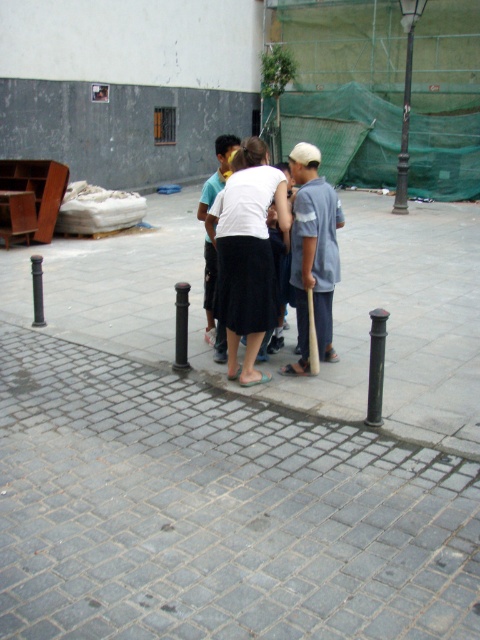
You are standing at the point marked as point (213, 304) in the image. What object is located at that point?

The point (213, 304) corresponds to the white cotton shirt at center.

You are a photographer trying to capture a candid shot of the group. You notice the white matte skirt at center and the wooden baseball bat at center. Which object should you focus on to ensure the subject is in the foreground?

The white matte skirt at center is above the wooden baseball bat at center, so focusing on the white matte skirt at center will ensure the subject is in the foreground.